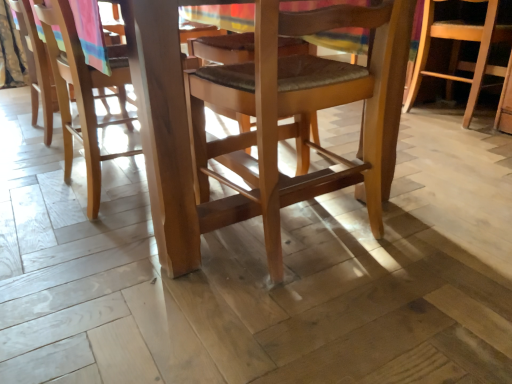
Question: Looking at their shapes, would you say light brown wood chair at left, the 2th chair when ordered from front to back, is wider or thinner than wooden chair at center, which appears as the first chair when viewed from the front?

Choices:
 (A) thin
 (B) wide

Answer: (A)

Question: In terms of size, does light brown wood chair at left, placed as the 1th chair when sorted from left to right, appear bigger or smaller than wooden chair at center, the 3th chair from the back?

Choices:
 (A) big
 (B) small

Answer: (B)

Question: Which object is the farthest from the wooden chair at center, positioned as the 3th chair in front-to-back order?

Choices:
 (A) wooden chair at center, the second chair from the right
 (B) light brown wood chair at left, placed as the 1th chair when sorted from left to right

Answer: (B)

Question: Which is farther from the wooden chair at center, the first chair viewed from the right?

Choices:
 (A) light brown wood chair at left, the 3th chair positioned from the right
 (B) wooden chair at center, the second chair from the right

Answer: (A)